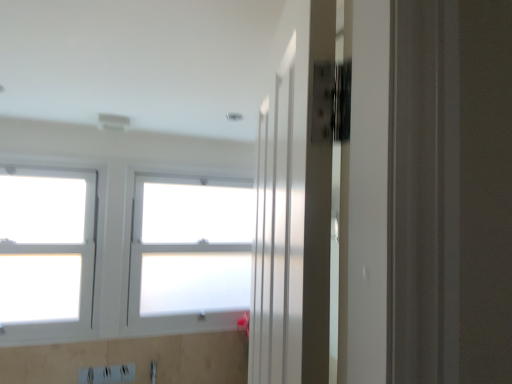
Question: Based on their positions, is white frosted glass window at center, the first window viewed from the right, located to the left or right of white glass window at left, the first window in the left-to-right sequence?

Choices:
 (A) left
 (B) right

Answer: (B)

Question: Do you think white frosted glass window at center, the first window viewed from the right, is within white glass window at left, the first window in the left-to-right sequence, or outside of it?

Choices:
 (A) inside
 (B) outside

Answer: (B)

Question: Is white frosted glass window at center, the first window viewed from the right, wider or thinner than white glass window at left, the first window in the left-to-right sequence?

Choices:
 (A) thin
 (B) wide

Answer: (A)

Question: Is white glass window at left, the first window in the left-to-right sequence, in front of or behind white frosted glass window at center, which is counted as the second window, starting from the left, in the image?

Choices:
 (A) behind
 (B) front

Answer: (B)

Question: From their relative heights in the image, would you say white glass window at left, the first window in the left-to-right sequence, is taller or shorter than white frosted glass window at center, which is counted as the second window, starting from the left?

Choices:
 (A) tall
 (B) short

Answer: (A)

Question: Considering the relative positions of white glass window at left, the first window in the left-to-right sequence, and white frosted glass window at center, which is counted as the second window, starting from the left, in the image provided, is white glass window at left, the first window in the left-to-right sequence, to the left or to the right of white frosted glass window at center, which is counted as the second window, starting from the left,?

Choices:
 (A) left
 (B) right

Answer: (A)

Question: Is white glass window at left, the first window in the left-to-right sequence, inside or outside of white frosted glass window at center, which is counted as the second window, starting from the left?

Choices:
 (A) outside
 (B) inside

Answer: (A)